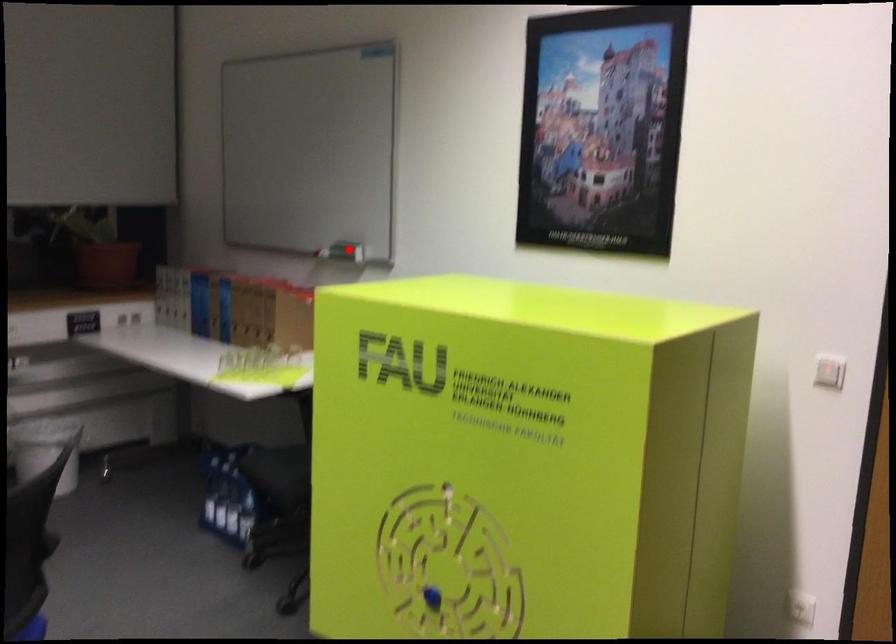
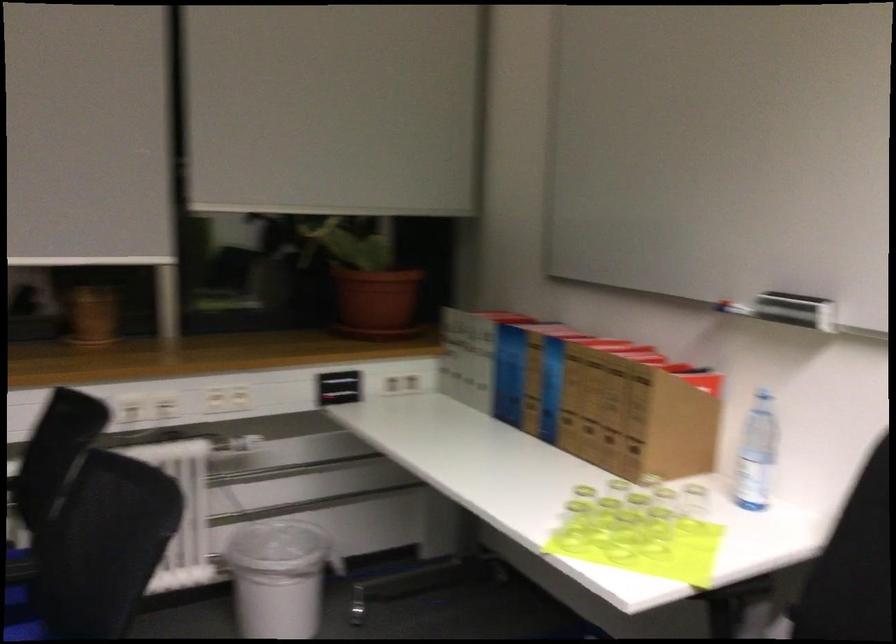
Question: I am providing you with two images of the same scene from different viewpoints. A red point is shown in image1. For the corresponding object point in image2, is it positioned nearer or farther from the camera?

Choices:
 (A) Nearer
 (B) Farther

Answer: (A)